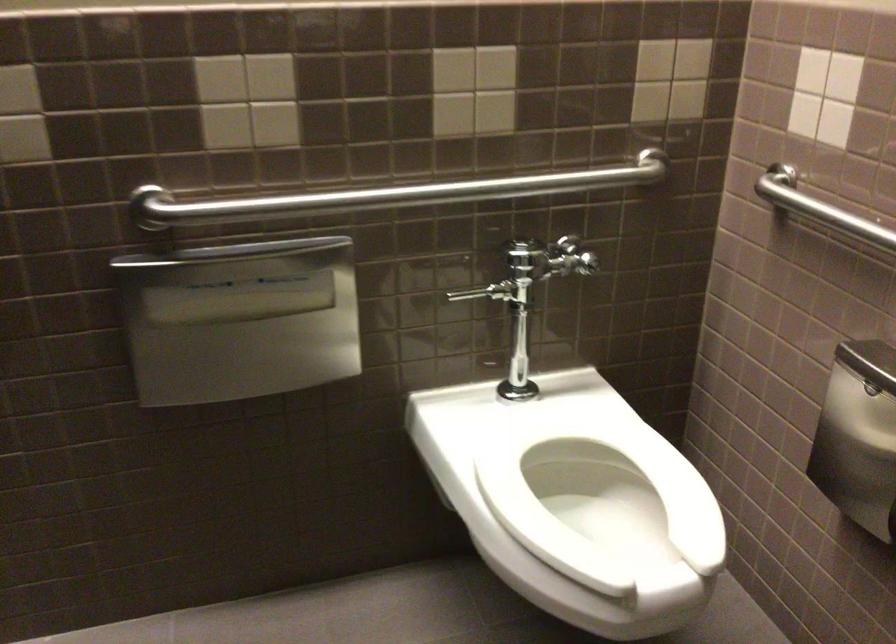
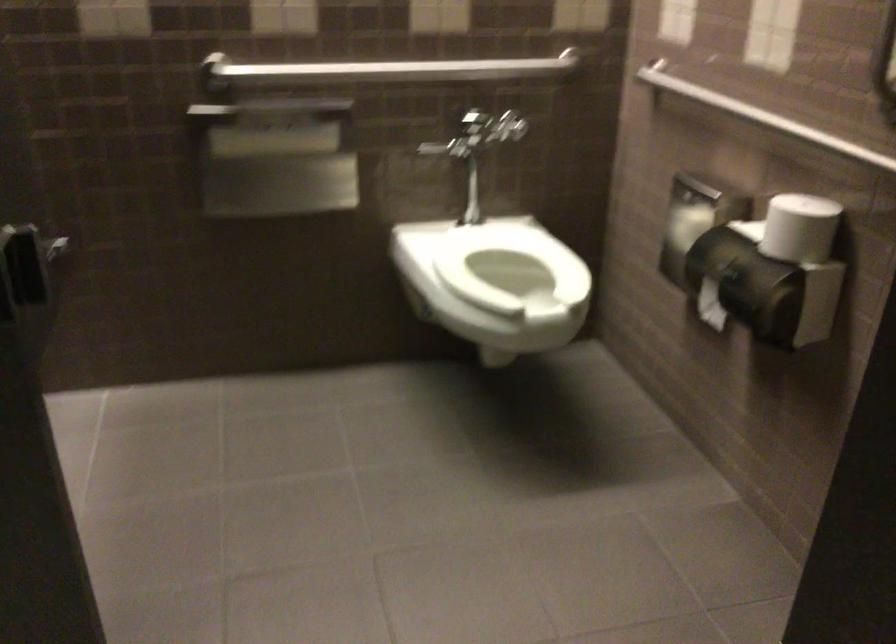
Find the pixel in the second image that matches point (405, 194) in the first image.

(391, 69)